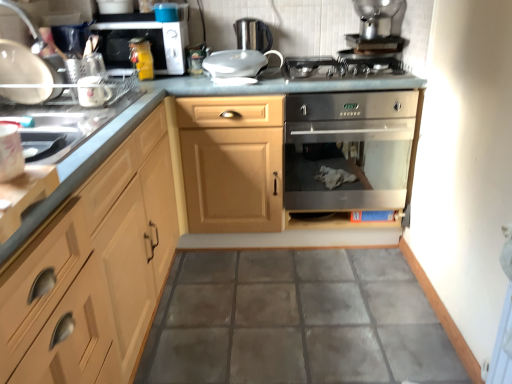
Question: Is stainless steel oven at center shorter than stainless steel gas stove at center?

Choices:
 (A) no
 (B) yes

Answer: (A)

Question: Considering the relative sizes of stainless steel oven at center and stainless steel gas stove at center in the image provided, is stainless steel oven at center bigger than stainless steel gas stove at center?

Choices:
 (A) yes
 (B) no

Answer: (A)

Question: Does stainless steel oven at center have a greater height compared to stainless steel gas stove at center?

Choices:
 (A) no
 (B) yes

Answer: (B)

Question: Can you confirm if stainless steel oven at center is wider than stainless steel gas stove at center?

Choices:
 (A) yes
 (B) no

Answer: (A)

Question: Would you say stainless steel oven at center contains stainless steel gas stove at center?

Choices:
 (A) no
 (B) yes

Answer: (A)

Question: Is white glossy mug at upper left, which ranks as the first appliance in left-to-right order, wider or thinner than satin silver oven at upper center?

Choices:
 (A) thin
 (B) wide

Answer: (A)

Question: Considering the positions of point (78, 82) and point (181, 36), is point (78, 82) closer or farther from the camera than point (181, 36)?

Choices:
 (A) closer
 (B) farther

Answer: (A)

Question: From the image's perspective, is white glossy mug at upper left, which is counted as the 5th appliance, starting from the right, located above or below satin silver oven at upper center?

Choices:
 (A) above
 (B) below

Answer: (B)

Question: Based on their positions, is white glossy mug at upper left, which appears as the 4th appliance when viewed from the top, located to the left or right of satin silver oven at upper center?

Choices:
 (A) right
 (B) left

Answer: (B)

Question: From a real-world perspective, relative to satin silver kettle at upper center, marked as the fourth appliance in a left-to-right arrangement, is white glossy mug at upper left, marked as the second appliance in a front-to-back arrangement, vertically above or below?

Choices:
 (A) above
 (B) below

Answer: (B)

Question: Is point (92, 89) closer or farther from the camera than point (260, 39)?

Choices:
 (A) closer
 (B) farther

Answer: (A)

Question: Looking at the image, does white glossy mug at upper left, which is counted as the 5th appliance, starting from the right, seem bigger or smaller compared to satin silver kettle at upper center, marked as the fourth appliance in a left-to-right arrangement?

Choices:
 (A) big
 (B) small

Answer: (B)

Question: Is white glossy mug at upper left, which is counted as the 5th appliance, starting from the right, taller or shorter than satin silver kettle at upper center, the first appliance when ordered from back to front?

Choices:
 (A) short
 (B) tall

Answer: (A)

Question: Is stainless steel gas stove at center inside or outside of light wood cabinet at left?

Choices:
 (A) outside
 (B) inside

Answer: (A)

Question: Looking at the image, does stainless steel gas stove at center seem bigger or smaller compared to light wood cabinet at left?

Choices:
 (A) small
 (B) big

Answer: (A)